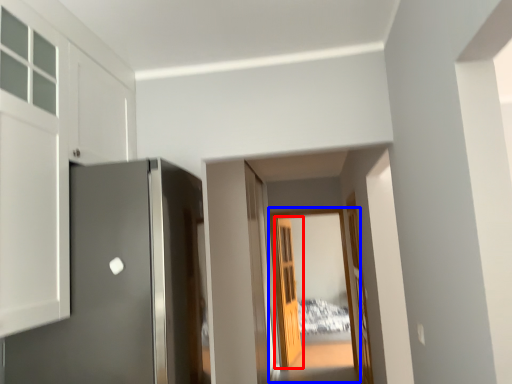
Question: Which point is closer to the camera, door (highlighted by a red box) or glass door (highlighted by a blue box)?

Choices:
 (A) door
 (B) glass door

Answer: (B)